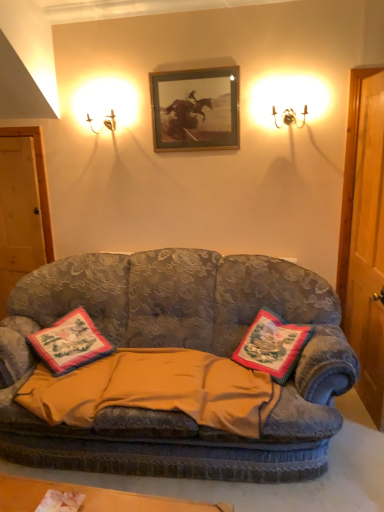
Question: Can you confirm if embroidered fabric pillow at center, the first pillow viewed from the left, is positioned to the left of gold-framed picture at upper center?

Choices:
 (A) no
 (B) yes

Answer: (B)

Question: Is embroidered fabric pillow at center, the first pillow viewed from the left, surrounding gold-framed picture at upper center?

Choices:
 (A) no
 (B) yes

Answer: (A)

Question: Is embroidered fabric pillow at center, the 2th pillow viewed from the right, further to the viewer compared to gold-framed picture at upper center?

Choices:
 (A) no
 (B) yes

Answer: (A)

Question: Considering the relative positions of embroidered fabric pillow at center, the first pillow viewed from the left, and gold-framed picture at upper center in the image provided, is embroidered fabric pillow at center, the first pillow viewed from the left, in front of gold-framed picture at upper center?

Choices:
 (A) yes
 (B) no

Answer: (A)

Question: Are embroidered fabric pillow at center, the first pillow viewed from the left, and gold-framed picture at upper center making contact?

Choices:
 (A) yes
 (B) no

Answer: (B)

Question: From a real-world perspective, is metallic wall sconce at upper left above or below embroidered fabric pillow at center, the first pillow viewed from the left?

Choices:
 (A) above
 (B) below

Answer: (A)

Question: Considering the positions of point (117, 112) and point (81, 337), is point (117, 112) closer or farther from the camera than point (81, 337)?

Choices:
 (A) closer
 (B) farther

Answer: (B)

Question: In terms of size, does metallic wall sconce at upper left appear bigger or smaller than embroidered fabric pillow at center, the first pillow viewed from the left?

Choices:
 (A) small
 (B) big

Answer: (A)

Question: In terms of width, does metallic wall sconce at upper left look wider or thinner when compared to embroidered fabric pillow at center, the 2th pillow viewed from the right?

Choices:
 (A) thin
 (B) wide

Answer: (A)

Question: In terms of size, does embroidered fabric pillow at center, the second pillow when ordered from left to right, appear bigger or smaller than gold-framed picture at upper center?

Choices:
 (A) small
 (B) big

Answer: (B)

Question: Considering their positions, is embroidered fabric pillow at center, which ranks as the first pillow in right-to-left order, located in front of or behind gold-framed picture at upper center?

Choices:
 (A) behind
 (B) front

Answer: (B)

Question: From a real-world perspective, is embroidered fabric pillow at center, which ranks as the first pillow in right-to-left order, above or below gold-framed picture at upper center?

Choices:
 (A) below
 (B) above

Answer: (A)

Question: In terms of height, does embroidered fabric pillow at center, the second pillow when ordered from left to right, look taller or shorter compared to gold-framed picture at upper center?

Choices:
 (A) short
 (B) tall

Answer: (A)

Question: Is yellow cotton blanket at center taller or shorter than wooden door at left?

Choices:
 (A) short
 (B) tall

Answer: (A)

Question: Is point (99, 360) closer or farther from the camera than point (41, 214)?

Choices:
 (A) farther
 (B) closer

Answer: (B)